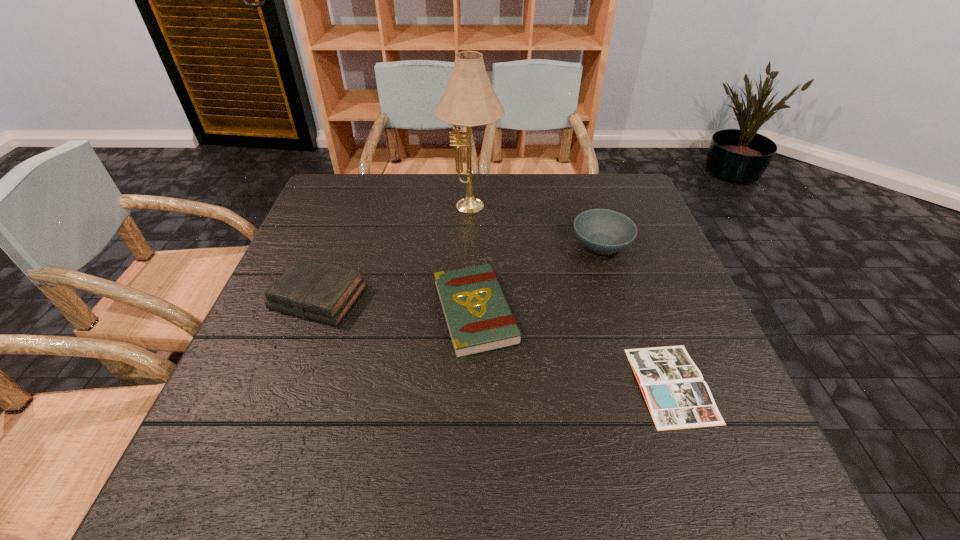
Locate an element on the screen. free location located on the right of the third tallest object is located at coordinates (403, 297).

At what (x,y) coordinates should I click in order to perform the action: click on vacant space located on the back of the fourth tallest object. Please return your answer as a coordinate pair (x, y). Looking at the image, I should click on (476, 212).

Where is `free space located on the left of the shortest book`? This screenshot has width=960, height=540. free space located on the left of the shortest book is located at coordinates pos(505,384).

I want to click on object located in the far edge section of the desktop, so click(x=469, y=100).

The image size is (960, 540). What are the coordinates of `object that is at the left edge` in the screenshot? It's located at (320, 291).

Identify the location of soup bowl that is positioned at the right edge. (602, 231).

Where is `book present at the right edge`? book present at the right edge is located at coordinates (677, 397).

In the image, there is a desktop. At what (x,y) coordinates should I click in order to perform the action: click on vacant space at the far edge. Please return your answer as a coordinate pair (x, y). This screenshot has width=960, height=540. Looking at the image, I should click on (520, 180).

You are a GUI agent. You are given a task and a screenshot of the screen. Output one action in this format:
    pyautogui.click(x=<x>, y=<y>)
    Task: Click on the free space at the near edge of the desktop
    The width and height of the screenshot is (960, 540).
    Given the screenshot: What is the action you would take?
    pyautogui.click(x=667, y=455)

At what (x,y) coordinates should I click in order to perform the action: click on vacant area at the left edge. Please return your answer as a coordinate pair (x, y). The height and width of the screenshot is (540, 960). Looking at the image, I should click on (343, 220).